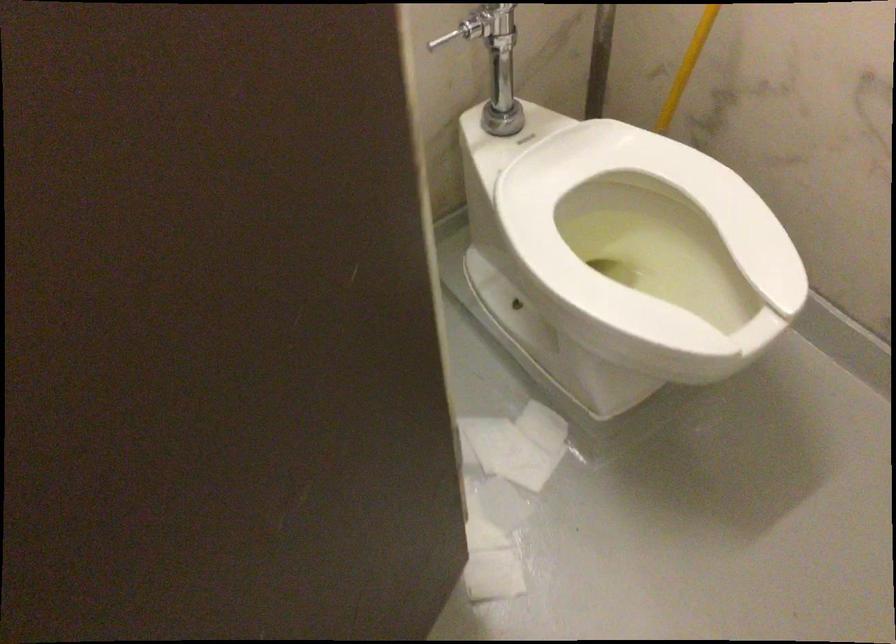
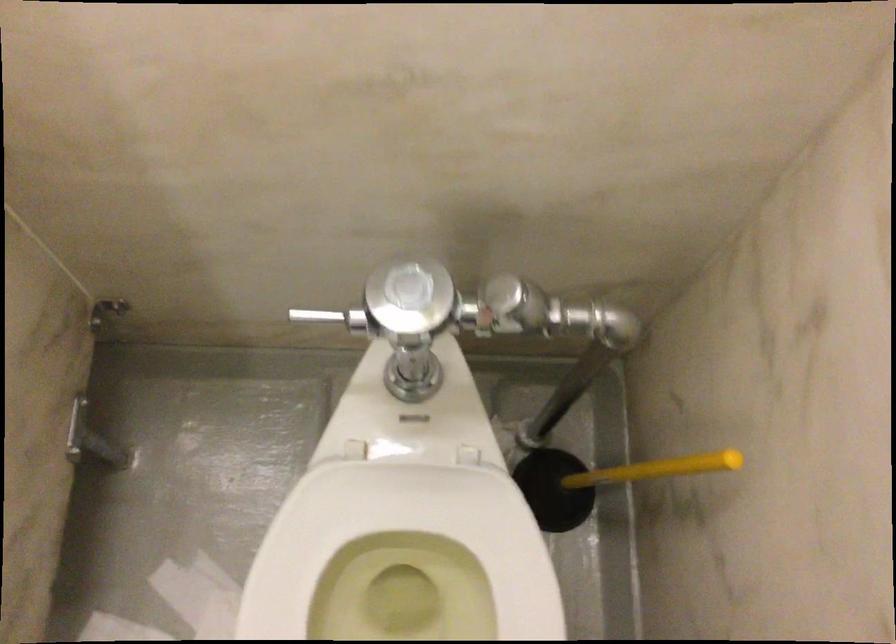
Question: How did the camera likely rotate?

Choices:
 (A) Left
 (B) Right
 (C) Up
 (D) Down

Answer: (D)